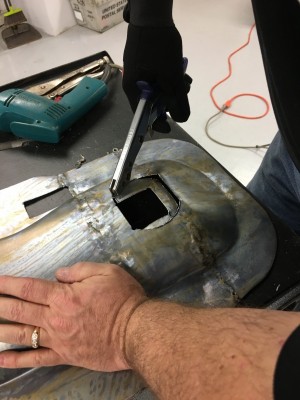
Image resolution: width=300 pixels, height=400 pixels. I want to click on white floor, so tap(206, 39), tap(51, 50), tap(1, 67), tap(230, 7), tap(250, 85), tap(238, 166).